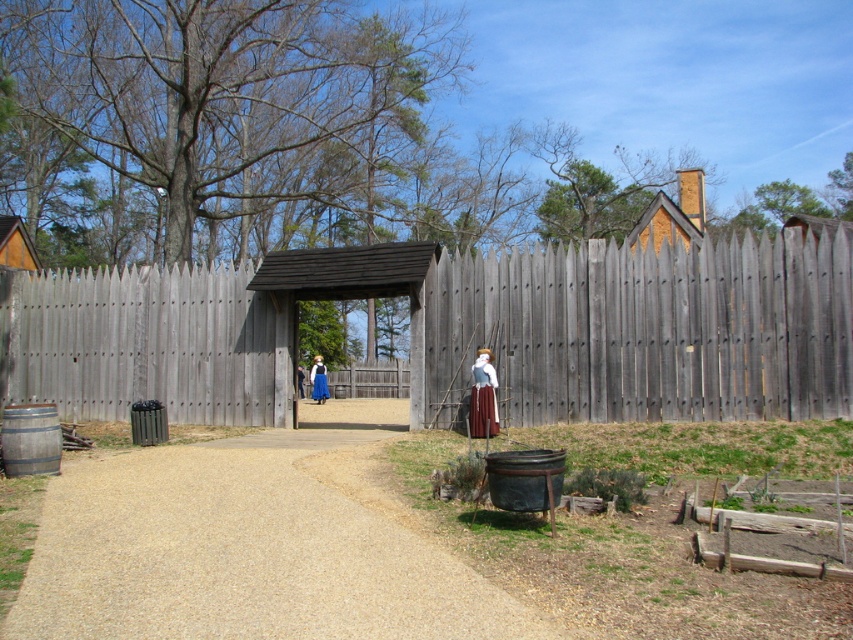
You are a visitor approaching the historical reenactment area. You see the gray wooden fence at center and the blue fabric dress at center. Which object is closer to you as you approach the entrance?

The gray wooden fence at center is closer to you than the blue fabric dress at center as you approach the entrance.

You are a visitor at this historical reenactment. You notice both the gray wooden fence at center and the blue fabric dress at center. Which object takes up more space in the scene?

The gray wooden fence at center is bigger than the blue fabric dress at center, so the gray wooden fence at center takes up more space in the scene.

You are standing at the entrance of the historical reenactment scene and see the point marked at coordinates point (x=648, y=330). What object is located at that point?

The point (x=648, y=330) marks the gray wooden fence at center.